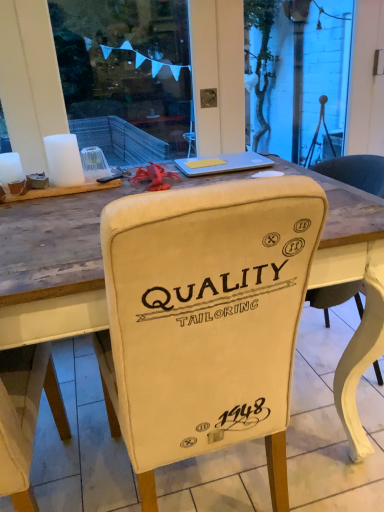
The height and width of the screenshot is (512, 384). I want to click on silver metallic laptop at upper center, so click(x=222, y=163).

Describe the element at coordinates (222, 163) in the screenshot. I see `silver metallic laptop at upper center` at that location.

Describe the element at coordinates (206, 319) in the screenshot. I see `beige fabric chair at center` at that location.

Measure the distance between point (147, 205) and camera.

A distance of 23.31 inches exists between point (147, 205) and camera.

What are the coordinates of `beige fabric chair at center` in the screenshot? It's located at (206, 319).

Identify the location of silver metallic laptop at upper center. (222, 163).

Which object is positioned more to the right, silver metallic laptop at upper center or beige fabric chair at center?

silver metallic laptop at upper center is more to the right.

Considering the positions of objects silver metallic laptop at upper center and beige fabric chair at center in the image provided, who is behind, silver metallic laptop at upper center or beige fabric chair at center?

silver metallic laptop at upper center is behind.

Does point (210, 162) appear closer or farther from the camera than point (286, 224)?

Point (210, 162) appears to be farther away from the viewer than point (286, 224).

From the image's perspective, is silver metallic laptop at upper center on top of beige fabric chair at center?

Indeed, from the image's perspective, silver metallic laptop at upper center is shown above beige fabric chair at center.

From a real-world perspective, who is located lower, silver metallic laptop at upper center or beige fabric chair at center?

In real-world perspective, beige fabric chair at center is lower.

Does silver metallic laptop at upper center have a lesser width compared to beige fabric chair at center?

Correct, the width of silver metallic laptop at upper center is less than that of beige fabric chair at center.

Considering the sizes of silver metallic laptop at upper center and beige fabric chair at center in the image, is silver metallic laptop at upper center taller or shorter than beige fabric chair at center?

Clearly, silver metallic laptop at upper center is shorter compared to beige fabric chair at center.

Which of these two, silver metallic laptop at upper center or beige fabric chair at center, is bigger?

beige fabric chair at center.

Would you say beige fabric chair at center is part of silver metallic laptop at upper center's contents?

No, silver metallic laptop at upper center does not contain beige fabric chair at center.

Is silver metallic laptop at upper center next to beige fabric chair at center and touching it?

No, silver metallic laptop at upper center is not making contact with beige fabric chair at center.

Is silver metallic laptop at upper center facing away from beige fabric chair at center?

That's not correct — silver metallic laptop at upper center is not looking away from beige fabric chair at center.

How different are the orientations of silver metallic laptop at upper center and beige fabric chair at center in degrees?

They differ by 180 degrees in their facing directions.

How distant is silver metallic laptop at upper center from beige fabric chair at center?

They are 34.32 inches apart.

What are the coordinates of `chair on the left of silver metallic laptop at upper center` in the screenshot? It's located at (206, 319).

Does beige fabric chair at center appear on the right side of silver metallic laptop at upper center?

No.

Which is in front, beige fabric chair at center or silver metallic laptop at upper center?

beige fabric chair at center is closer to the camera.

Which is in front, point (116, 386) or point (192, 169)?

The point (116, 386) is in front.

From the image's perspective, is beige fabric chair at center located above or below silver metallic laptop at upper center?

Clearly, from the image's perspective, beige fabric chair at center is below silver metallic laptop at upper center.

From a real-world perspective, does beige fabric chair at center stand above silver metallic laptop at upper center?

No, from a real-world perspective, beige fabric chair at center is not on top of silver metallic laptop at upper center.

Considering the relative sizes of beige fabric chair at center and silver metallic laptop at upper center in the image provided, is beige fabric chair at center thinner than silver metallic laptop at upper center?

Incorrect, the width of beige fabric chair at center is not less than that of silver metallic laptop at upper center.

Between beige fabric chair at center and silver metallic laptop at upper center, which one has more height?

beige fabric chair at center.

Looking at the image, does beige fabric chair at center seem bigger or smaller compared to silver metallic laptop at upper center?

In the image, beige fabric chair at center appears to be larger than silver metallic laptop at upper center.

Is beige fabric chair at center situated inside silver metallic laptop at upper center or outside?

beige fabric chair at center cannot be found inside silver metallic laptop at upper center.

Is beige fabric chair at center touching silver metallic laptop at upper center?

No, beige fabric chair at center is not beside silver metallic laptop at upper center.

Could you tell me if beige fabric chair at center is facing silver metallic laptop at upper center?

Yes, beige fabric chair at center faces towards silver metallic laptop at upper center.

Measure the distance from beige fabric chair at center to silver metallic laptop at upper center.

The distance of beige fabric chair at center from silver metallic laptop at upper center is 34.32 inches.

Locate an element on the screen. The width and height of the screenshot is (384, 512). laptop located on the right of beige fabric chair at center is located at coordinates (222, 163).

Locate an element on the screen. laptop located behind the beige fabric chair at center is located at coordinates (222, 163).

Identify the location of laptop on the right of beige fabric chair at center. (222, 163).